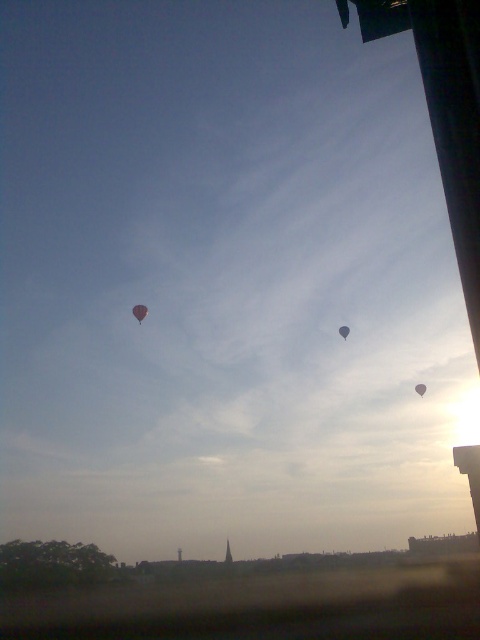
Does matte pink balloon at upper center have a smaller size compared to matte gray balloon at center?

No, matte pink balloon at upper center is not smaller than matte gray balloon at center.

This screenshot has width=480, height=640. What do you see at coordinates (140, 310) in the screenshot?
I see `matte pink balloon at upper center` at bounding box center [140, 310].

You are a GUI agent. You are given a task and a screenshot of the screen. Output one action in this format:
    pyautogui.click(x=<x>, y=<y>)
    Task: Click on the matte pink balloon at upper center
    
    Given the screenshot: What is the action you would take?
    pyautogui.click(x=140, y=310)

Who is positioned more to the right, gray matte balloon at upper center or matte gray balloon at center?

Positioned to the right is gray matte balloon at upper center.

The width and height of the screenshot is (480, 640). What are the coordinates of `gray matte balloon at upper center` in the screenshot? It's located at (420, 388).

Does point (145, 308) come in front of point (419, 394)?

No, (145, 308) is further to viewer.

Describe the element at coordinates (140, 310) in the screenshot. I see `matte pink balloon at upper center` at that location.

Describe the element at coordinates (140, 310) in the screenshot. I see `matte pink balloon at upper center` at that location.

Identify the location of matte pink balloon at upper center. (140, 310).